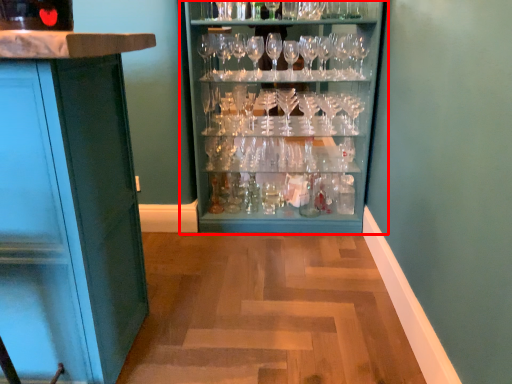
Question: Considering the relative positions of cupboard (annotated by the red box) and cabinetry in the image provided, where is cupboard (annotated by the red box) located with respect to the staircase?

Choices:
 (A) left
 (B) right

Answer: (B)